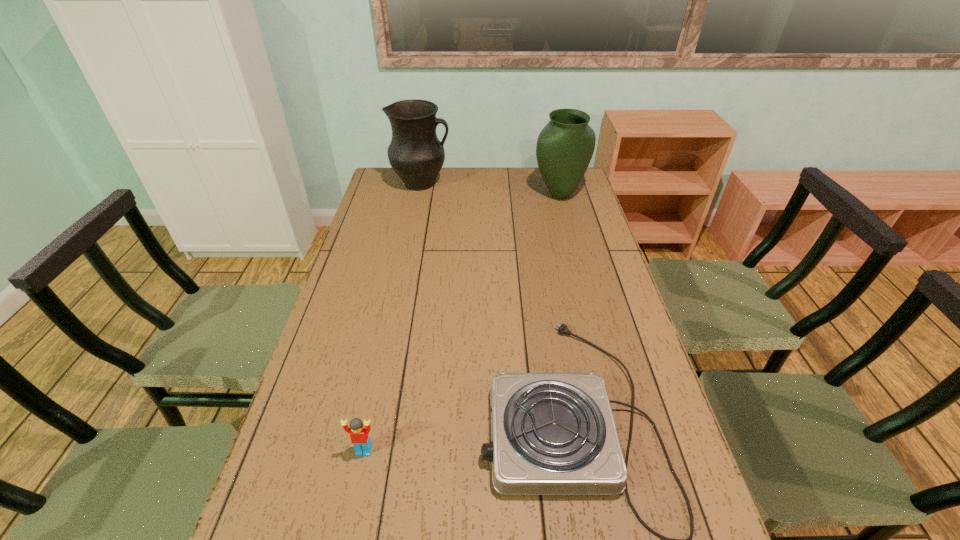
The width and height of the screenshot is (960, 540). In order to click on vase in this screenshot , I will do `click(565, 146)`.

I want to click on pitcher, so click(415, 153).

The image size is (960, 540). Find the location of `Lego`. Lego is located at coordinates (359, 431).

The image size is (960, 540). I want to click on free point located 0.330m on the left of the vase, so click(453, 194).

The width and height of the screenshot is (960, 540). Identify the location of free region located on the handle side of the pitcher. (540, 184).

I want to click on free spot located on the face of the Lego, so click(x=348, y=528).

In order to click on vase located in the far edge section of the desktop in this screenshot , I will do `click(565, 146)`.

Locate an element on the screen. This screenshot has width=960, height=540. pitcher present at the far edge is located at coordinates (415, 153).

The height and width of the screenshot is (540, 960). In order to click on pitcher that is at the left edge in this screenshot , I will do (x=415, y=153).

This screenshot has width=960, height=540. Identify the location of Lego present at the left edge. (359, 431).